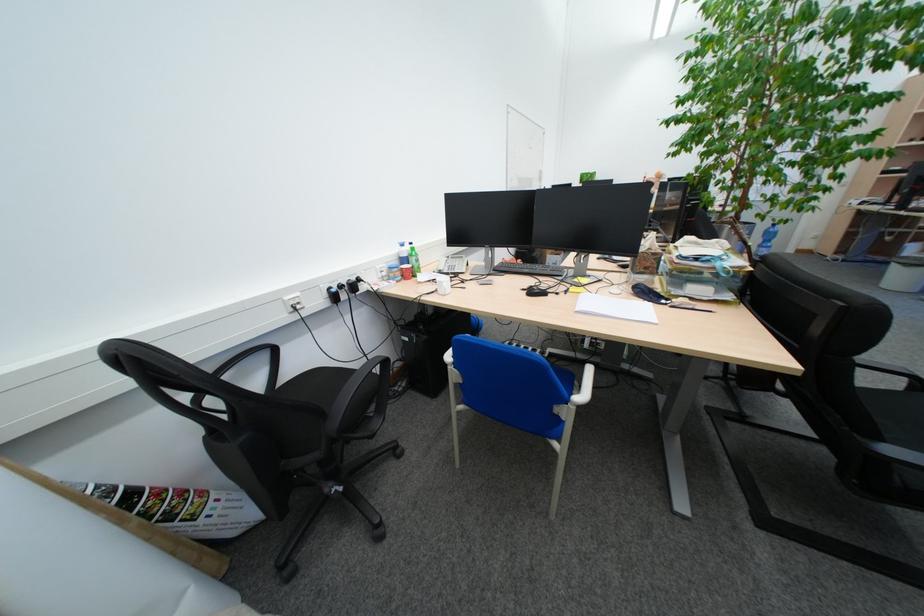
At what (x,y) coordinates should I click in order to perform the action: click on phone handset. Please return your answer as a coordinate pair (x, y). This screenshot has height=616, width=924. Looking at the image, I should click on (454, 264).